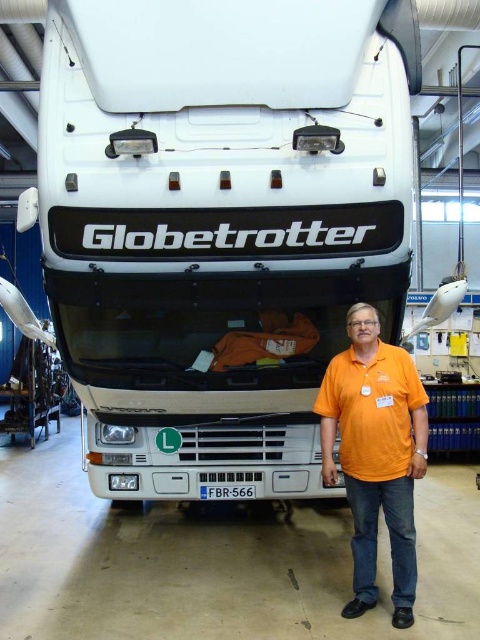
Question: Is white matte truck at center smaller than orange cotton shirt at center?

Choices:
 (A) yes
 (B) no

Answer: (B)

Question: Is white matte truck at center closer to camera compared to orange cotton shirt at center?

Choices:
 (A) yes
 (B) no

Answer: (A)

Question: Which object appears closest to the camera in this image?

Choices:
 (A) orange cotton shirt at center
 (B) white matte truck at center

Answer: (B)

Question: Does white matte truck at center appear on the left side of orange cotton shirt at center?

Choices:
 (A) yes
 (B) no

Answer: (A)

Question: Which point is farther to the camera?

Choices:
 (A) (399, 394)
 (B) (177, 84)

Answer: (A)